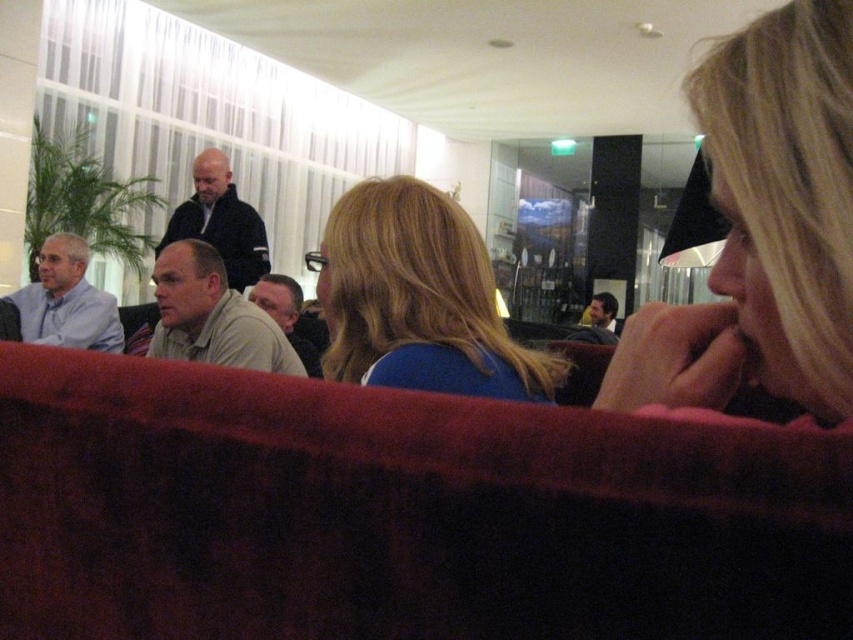
You are a photographer standing in the room and want to take a photo that includes both the blonde hair at upper right and the light beige sweater at center. Can you position yourself in a way that both subjects are in the same frame without moving them? Explain your reasoning.

The distance between the blonde hair at upper right and the light beige sweater at center is 2.00 meters. Since the photographer can adjust their position and angle to capture both subjects within the camera frame, it is possible to include both in the same photo without moving them.

You are a photographer trying to capture the light beige shirt at center and the light beige sweater at center in a single shot. Which one will appear closer to the camera in the photo?

The light beige shirt at center is below the light beige sweater at center, so in the photo, the light beige sweater at center will appear closer to the camera because it is positioned above the light beige shirt at center.